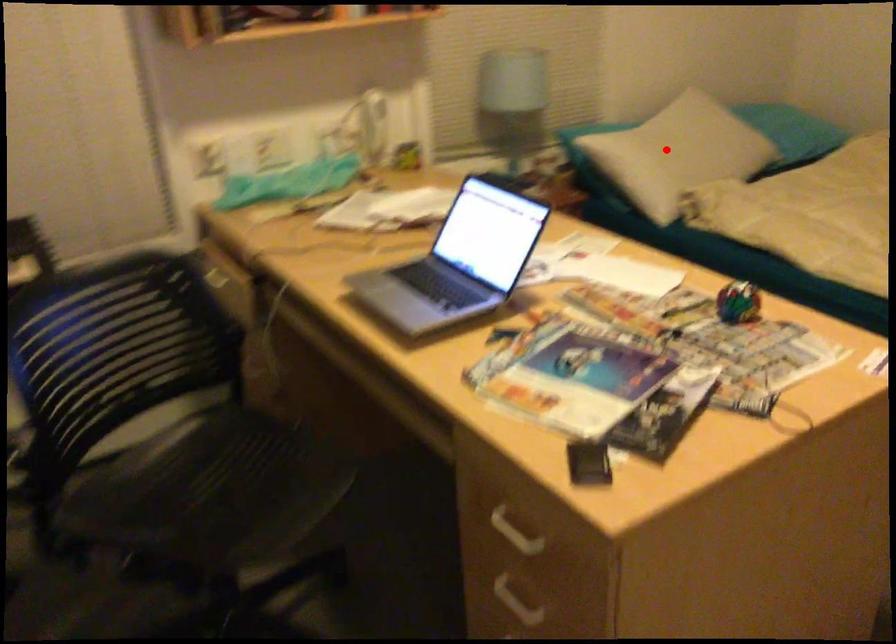
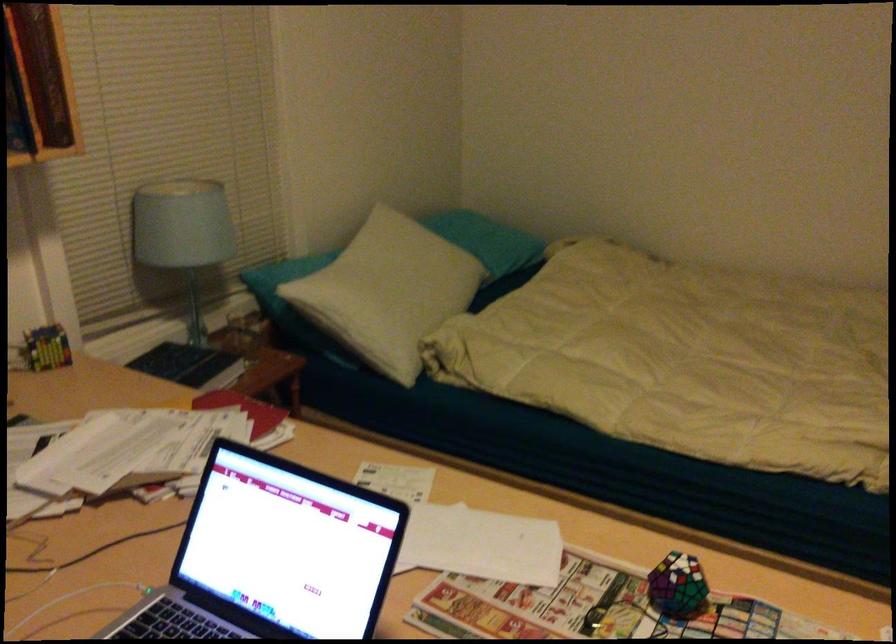
Question: I am providing you with two images of the same scene from different viewpoints. In image1, a red point is highlighted. Considering the same 3D point in image2, which of the following is correct?

Choices:
 (A) It is closer
 (B) It is farther

Answer: (A)